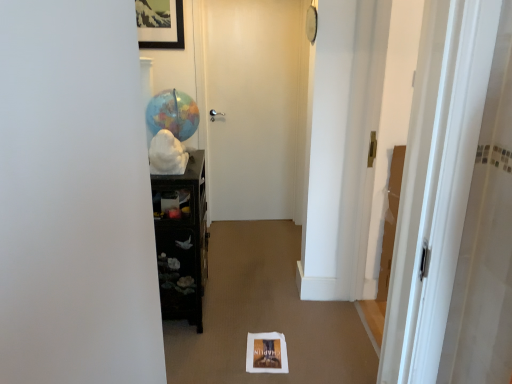
Question: From the image's perspective, does white matte door at center, marked as the first door in a left-to-right arrangement, appear higher than black glossy cabinet at left?

Choices:
 (A) no
 (B) yes

Answer: (B)

Question: Can you confirm if white matte door at center, marked as the first door in a left-to-right arrangement, is taller than black glossy cabinet at left?

Choices:
 (A) no
 (B) yes

Answer: (B)

Question: Is white matte door at center, which is the second door in front-to-back order, oriented towards black glossy cabinet at left?

Choices:
 (A) yes
 (B) no

Answer: (A)

Question: From a real-world perspective, is white matte door at center, the second door when ordered from right to left, positioned under black glossy cabinet at left based on gravity?

Choices:
 (A) no
 (B) yes

Answer: (A)

Question: Considering the relative positions of white matte door at center, the second door when ordered from right to left, and black glossy cabinet at left in the image provided, is white matte door at center, the second door when ordered from right to left, to the left of black glossy cabinet at left from the viewer's perspective?

Choices:
 (A) no
 (B) yes

Answer: (A)

Question: Is white matte door at center, which is the second door in front-to-back order, located outside black glossy cabinet at left?

Choices:
 (A) yes
 (B) no

Answer: (A)

Question: Does black glossy cabinet at left have a larger size compared to wooden framed picture at upper center?

Choices:
 (A) yes
 (B) no

Answer: (A)

Question: Can you confirm if black glossy cabinet at left is taller than wooden framed picture at upper center?

Choices:
 (A) yes
 (B) no

Answer: (A)

Question: Does black glossy cabinet at left appear on the left side of wooden framed picture at upper center?

Choices:
 (A) yes
 (B) no

Answer: (B)

Question: Is black glossy cabinet at left next to wooden framed picture at upper center?

Choices:
 (A) no
 (B) yes

Answer: (A)

Question: Considering the relative sizes of black glossy cabinet at left and wooden framed picture at upper center in the image provided, is black glossy cabinet at left shorter than wooden framed picture at upper center?

Choices:
 (A) no
 (B) yes

Answer: (A)

Question: Does black glossy cabinet at left turn towards wooden framed picture at upper center?

Choices:
 (A) no
 (B) yes

Answer: (A)

Question: Is the depth of black glossy cabinet at left greater than that of matte globe at center?

Choices:
 (A) no
 (B) yes

Answer: (A)